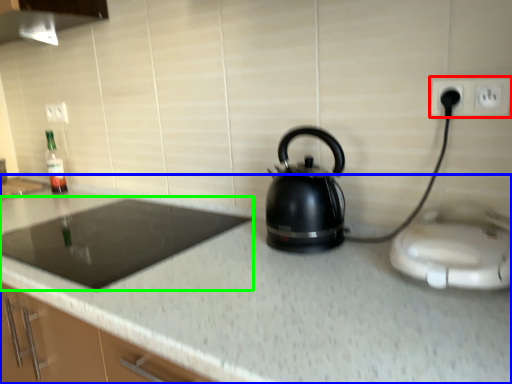
Question: Estimate the real-world distances between objects in this image. Which object is closer to electric outlet (highlighted by a red box), countertop (highlighted by a blue box) or gas stove (highlighted by a green box)?

Choices:
 (A) countertop
 (B) gas stove

Answer: (A)